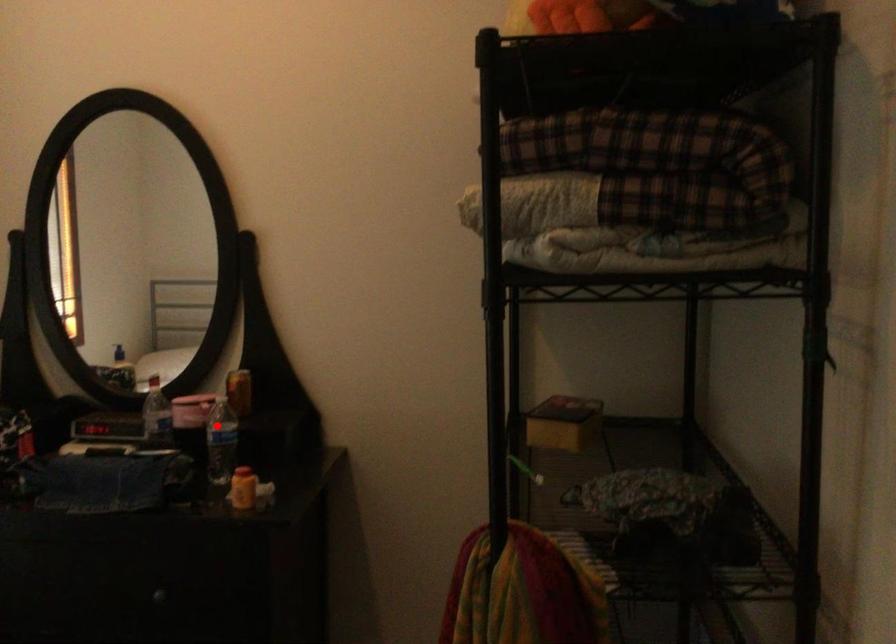
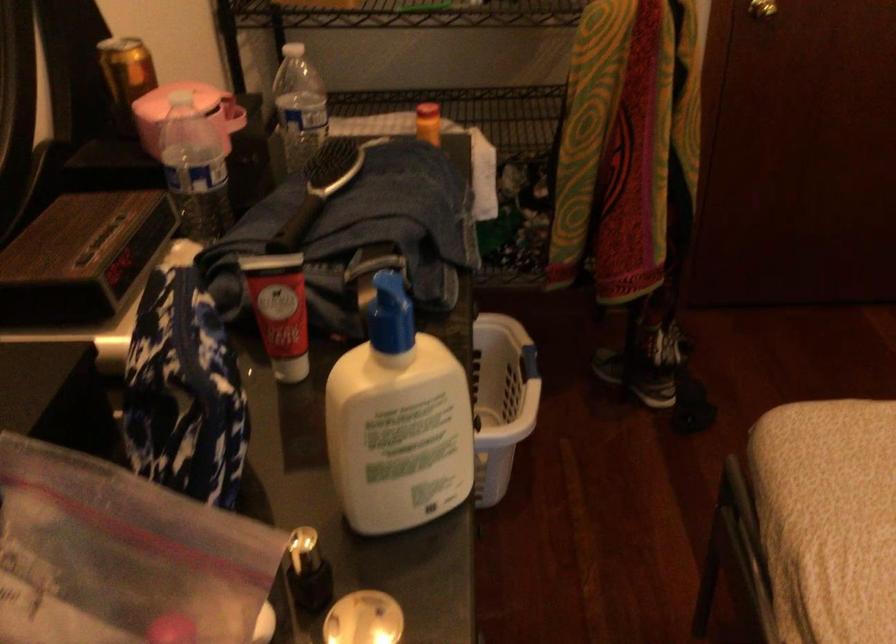
Question: I am providing you with two images of the same scene from different viewpoints. In image1, a red point is highlighted. Considering the same 3D point in image2, which of the following is correct?

Choices:
 (A) It is closer
 (B) It is farther

Answer: (A)